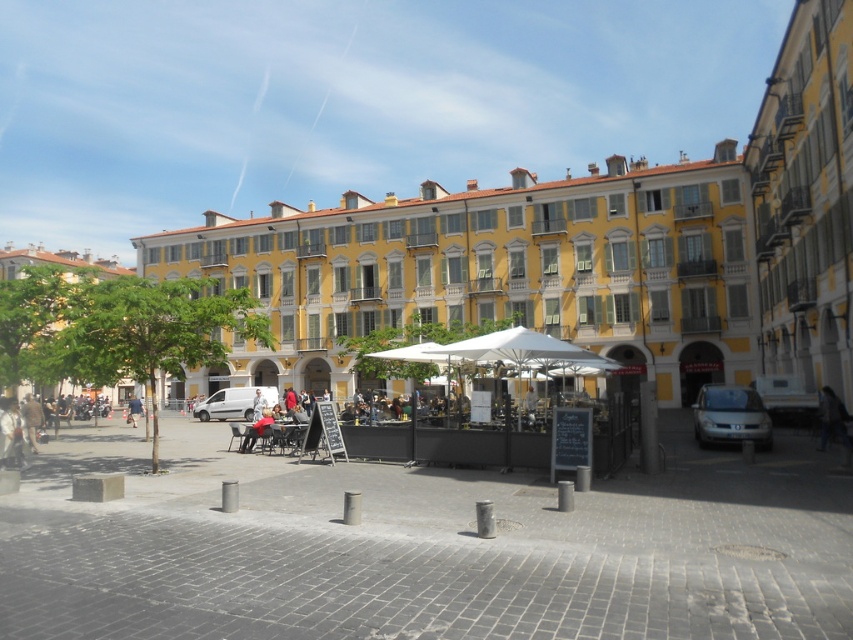
Question: Is denim jacket at center thinner than denim jacket at lower left?

Choices:
 (A) no
 (B) yes

Answer: (B)

Question: Which object is farther from the camera taking this photo?

Choices:
 (A) denim jacket at center
 (B) denim jacket at lower left

Answer: (B)

Question: Which object appears closest to the camera in this image?

Choices:
 (A) denim jacket at lower left
 (B) denim jacket at center

Answer: (B)

Question: Is the position of denim jacket at center more distant than that of denim jacket at lower left?

Choices:
 (A) no
 (B) yes

Answer: (A)

Question: Which point appears closest to the camera in this image?

Choices:
 (A) (134, 412)
 (B) (247, 448)

Answer: (B)

Question: Is denim jacket at center wider than denim jacket at lower left?

Choices:
 (A) no
 (B) yes

Answer: (A)